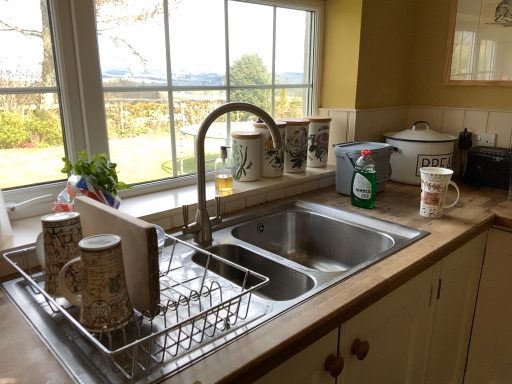
Where is `unoccupied area in front of brown ceramic mug at left, which is the 1th mug in bottom-to-top order`? The width and height of the screenshot is (512, 384). unoccupied area in front of brown ceramic mug at left, which is the 1th mug in bottom-to-top order is located at coordinates (99, 349).